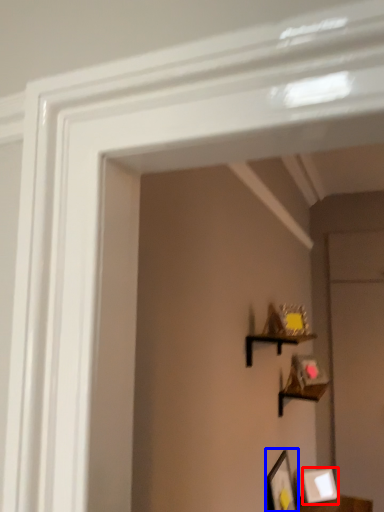
Question: Which object appears closest to the camera in this image, picture frame (highlighted by a red box) or picture frame (highlighted by a blue box)?

Choices:
 (A) picture frame
 (B) picture frame

Answer: (B)